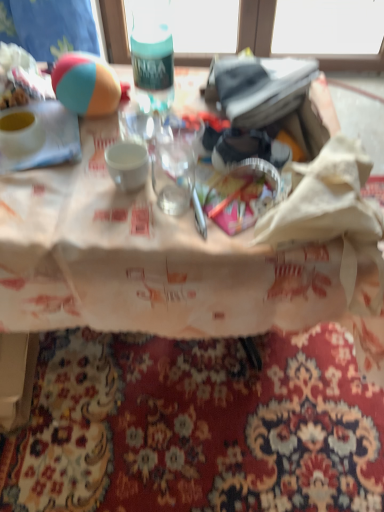
Question: Does matte white bowl at upper left have a larger size compared to translucent plastic cup at center?

Choices:
 (A) yes
 (B) no

Answer: (B)

Question: Does matte white bowl at upper left have a lesser height compared to translucent plastic cup at center?

Choices:
 (A) yes
 (B) no

Answer: (B)

Question: Is matte white bowl at upper left aimed at translucent plastic cup at center?

Choices:
 (A) no
 (B) yes

Answer: (A)

Question: Are matte white bowl at upper left and translucent plastic cup at center located far from each other?

Choices:
 (A) yes
 (B) no

Answer: (B)

Question: Can you confirm if matte white bowl at upper left is smaller than translucent plastic cup at center?

Choices:
 (A) no
 (B) yes

Answer: (B)

Question: Is point (28, 142) positioned closer to the camera than point (135, 66)?

Choices:
 (A) farther
 (B) closer

Answer: (B)

Question: Is matte white bowl at upper left taller or shorter than teal matte bottle at upper center?

Choices:
 (A) tall
 (B) short

Answer: (B)

Question: Is matte white bowl at upper left situated inside teal matte bottle at upper center or outside?

Choices:
 (A) outside
 (B) inside

Answer: (A)

Question: Considering their positions, is matte white bowl at upper left located in front of or behind teal matte bottle at upper center?

Choices:
 (A) behind
 (B) front

Answer: (A)

Question: Looking at their shapes, would you say tri-color rubber ball at upper left is wider or thinner than matte white bowl at upper left?

Choices:
 (A) wide
 (B) thin

Answer: (B)

Question: Is point (74, 97) positioned closer to the camera than point (39, 139)?

Choices:
 (A) closer
 (B) farther

Answer: (B)

Question: Is tri-color rubber ball at upper left spatially inside matte white bowl at upper left, or outside of it?

Choices:
 (A) outside
 (B) inside

Answer: (A)

Question: From a real-world perspective, is tri-color rubber ball at upper left above or below matte white bowl at upper left?

Choices:
 (A) above
 (B) below

Answer: (A)

Question: Relative to teal matte bottle at upper center, is translucent plastic cup at center in front or behind?

Choices:
 (A) behind
 (B) front

Answer: (B)

Question: Which is correct: translucent plastic cup at center is inside teal matte bottle at upper center, or outside of it?

Choices:
 (A) inside
 (B) outside

Answer: (B)